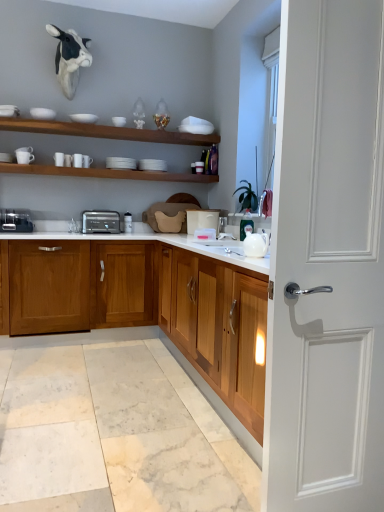
Question: Considering the relative sizes of white matte bowl at upper left, the fifth tableware from the bottom, and white glossy shelves at upper center, the 1th shelf in the top-to-bottom sequence, in the image provided, is white matte bowl at upper left, the fifth tableware from the bottom, smaller than white glossy shelves at upper center, the 1th shelf in the top-to-bottom sequence,?

Choices:
 (A) no
 (B) yes

Answer: (B)

Question: Is white matte bowl at upper left, the fifth tableware from the bottom, taller than white glossy shelves at upper center, the 1th shelf in the top-to-bottom sequence?

Choices:
 (A) yes
 (B) no

Answer: (A)

Question: From the image's perspective, is white matte bowl at upper left, the fifth tableware from the bottom, on white glossy shelves at upper center, the second shelf positioned from the bottom?

Choices:
 (A) yes
 (B) no

Answer: (A)

Question: Does white matte bowl at upper left, marked as the first tableware in a top-to-bottom arrangement, come behind white glossy shelves at upper center, the 1th shelf in the top-to-bottom sequence?

Choices:
 (A) yes
 (B) no

Answer: (A)

Question: Is white matte bowl at upper left, marked as the first tableware in a top-to-bottom arrangement, positioned beyond the bounds of white glossy shelves at upper center, the second shelf positioned from the bottom?

Choices:
 (A) yes
 (B) no

Answer: (A)

Question: Is white matte bowl at upper left, the fourth tableware viewed from the right, directly adjacent to white glossy shelves at upper center, the 1th shelf in the top-to-bottom sequence?

Choices:
 (A) no
 (B) yes

Answer: (A)

Question: From a real-world perspective, is metallic silver toaster at left, which is the second appliance from right to left, physically below white glossy teapot at right?

Choices:
 (A) yes
 (B) no

Answer: (B)

Question: Is metallic silver toaster at left, which is the second appliance from right to left, taller than white glossy teapot at right?

Choices:
 (A) no
 (B) yes

Answer: (B)

Question: Is metallic silver toaster at left, the first appliance viewed from the left, smaller than white glossy teapot at right?

Choices:
 (A) no
 (B) yes

Answer: (A)

Question: Is metallic silver toaster at left, which is the second appliance from right to left, at the right side of white glossy teapot at right?

Choices:
 (A) yes
 (B) no

Answer: (B)

Question: Is metallic silver toaster at left, which is the second appliance from right to left, oriented away from white glossy teapot at right?

Choices:
 (A) no
 (B) yes

Answer: (A)

Question: Is metallic silver toaster at left, which is the second appliance from right to left, bigger than white glossy teapot at right?

Choices:
 (A) no
 (B) yes

Answer: (B)

Question: From the image's perspective, is white matte door at right beneath white ceramic cup at left, positioned as the second tableware in bottom-to-top order?

Choices:
 (A) no
 (B) yes

Answer: (B)